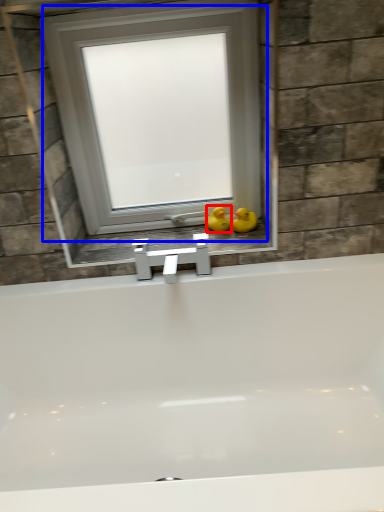
Question: Among these objects, which one is farthest to the camera, duck (highlighted by a red box) or window (highlighted by a blue box)?

Choices:
 (A) duck
 (B) window

Answer: (A)